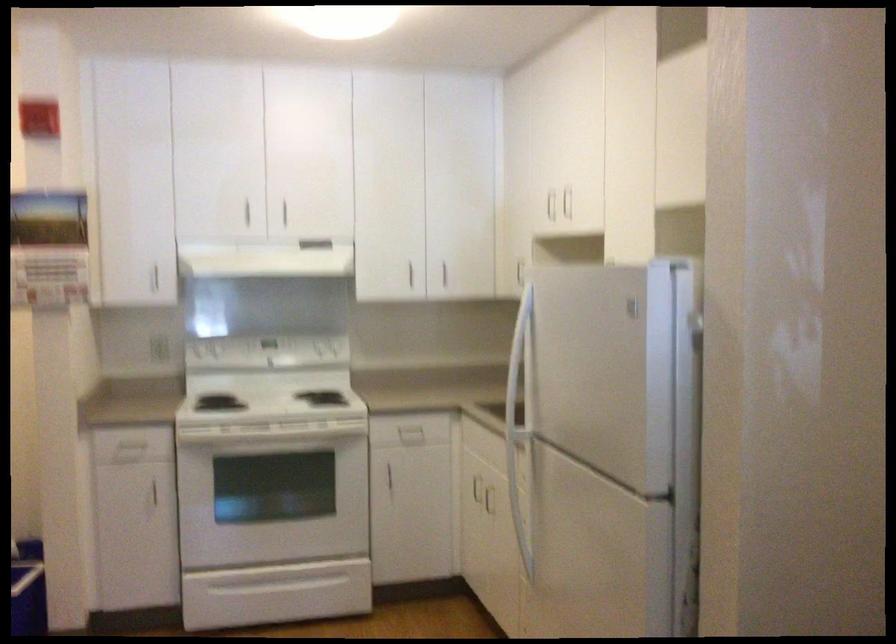
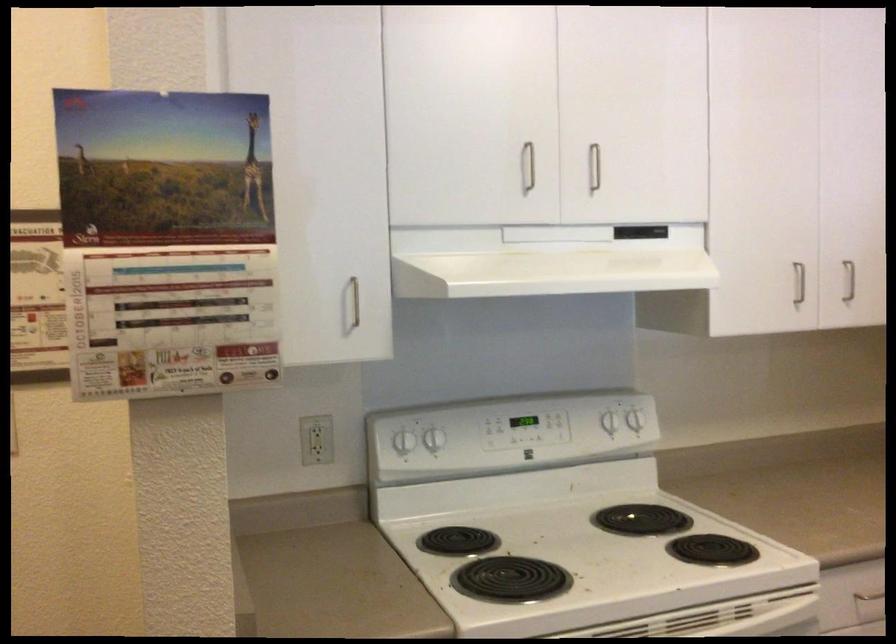
Where in the second image is the point corresponding to point (213, 346) from the first image?

(435, 439)